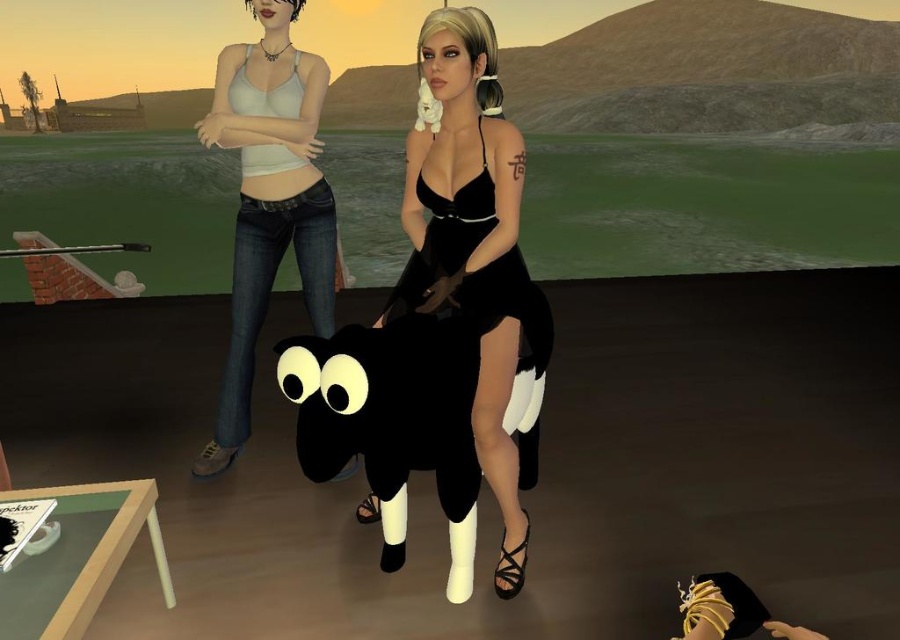
Is point (382, 513) positioned behind point (286, 182)?

No, it is in front of (286, 182).

Can you confirm if black matte plush sheep at center is bigger than matte white tank top at center?

No.

Where is `black matte plush sheep at center`? The image size is (900, 640). black matte plush sheep at center is located at coordinates (392, 420).

This screenshot has width=900, height=640. In order to click on black matte plush sheep at center in this screenshot , I will do `click(392, 420)`.

Can you confirm if velvet black dress at center is smaller than black satin dress at center?

No, velvet black dress at center is not smaller than black satin dress at center.

Consider the image. Can you confirm if velvet black dress at center is thinner than black satin dress at center?

Indeed, velvet black dress at center has a lesser width compared to black satin dress at center.

Between point (364, 502) and point (430, 250), which one is positioned in front?

Point (430, 250) is more forward.

This screenshot has width=900, height=640. Find the location of `velvet black dress at center`. velvet black dress at center is located at coordinates (474, 250).

Does velvet black dress at center have a lesser height compared to matte white tank top at center?

Yes.

Locate an element on the screen. This screenshot has width=900, height=640. velvet black dress at center is located at coordinates (474, 250).

Where is `velvet black dress at center`? velvet black dress at center is located at coordinates (474, 250).